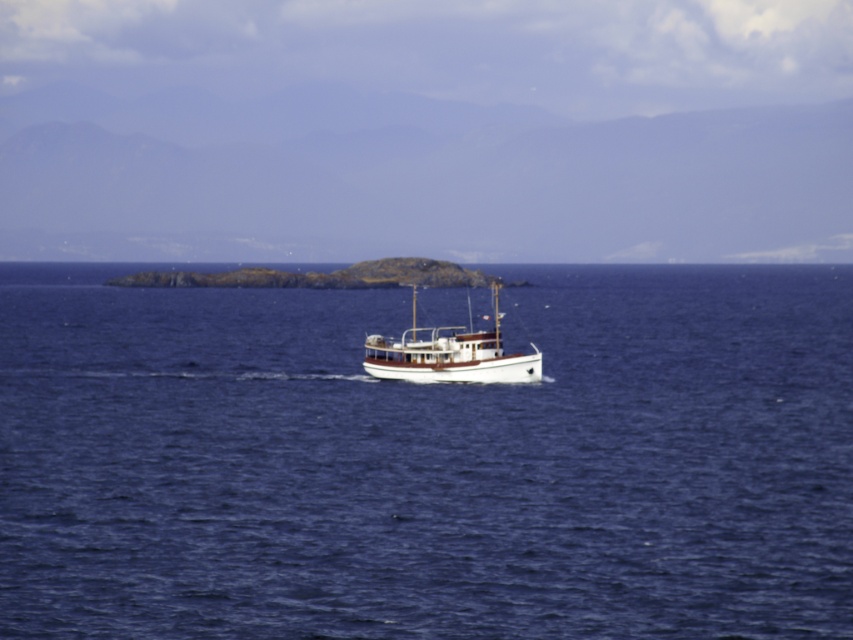
Question: Which point is closer to the camera?

Choices:
 (A) (495, 433)
 (B) (485, 380)

Answer: (A)

Question: Among these objects, which one is nearest to the camera?

Choices:
 (A) blue water at center
 (B) wooden boat at center

Answer: (A)

Question: Is blue water at center closer to camera compared to wooden boat at center?

Choices:
 (A) yes
 (B) no

Answer: (A)

Question: Can you confirm if blue water at center is positioned to the left of wooden boat at center?

Choices:
 (A) yes
 (B) no

Answer: (A)

Question: Does blue water at center appear on the left side of wooden boat at center?

Choices:
 (A) no
 (B) yes

Answer: (B)